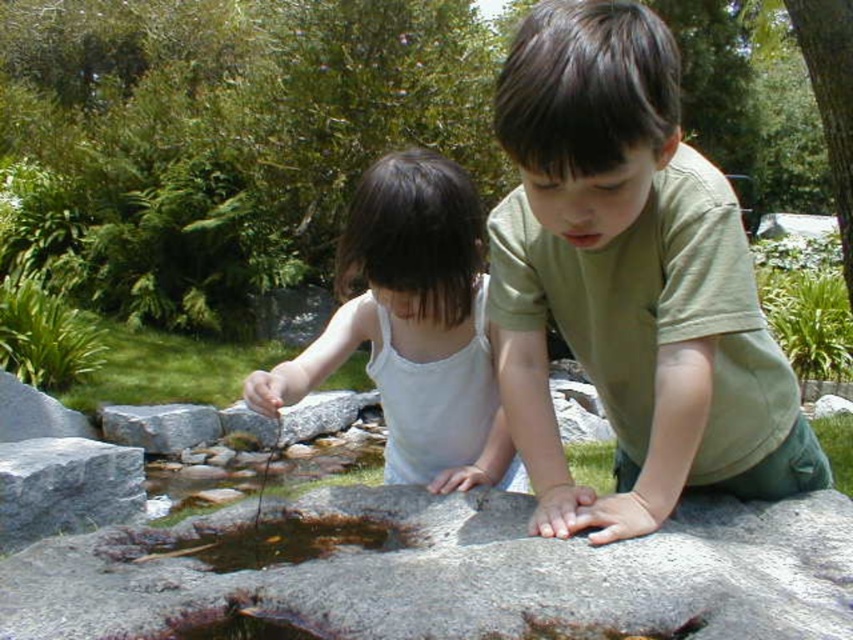
Is point (695, 484) positioned after point (44, 452)?

No, (695, 484) is closer to viewer.

Is point (599, 189) in front of point (71, 442)?

Yes, point (599, 189) is in front of point (71, 442).

Who is more distant from viewer, (589, 342) or (9, 512)?

Point (9, 512)

Identify the location of green cotton shirt at center. This screenshot has width=853, height=640. (630, 280).

Who is higher up, gray smooth rock at center or gray rough stone at lower left?

Positioned higher is gray smooth rock at center.

Who is more forward, (x=309, y=497) or (x=22, y=490)?

Point (x=309, y=497) is more forward.

This screenshot has height=640, width=853. Find the location of `gray smooth rock at center`. gray smooth rock at center is located at coordinates (457, 573).

Does point (368, 205) come farther from viewer compared to point (90, 468)?

That is False.

Is white fabric shirt at center below gray rough stone at lower left?

No.

The width and height of the screenshot is (853, 640). Describe the element at coordinates (413, 326) in the screenshot. I see `white fabric shirt at center` at that location.

Find the location of `white fabric shirt at center`. white fabric shirt at center is located at coordinates (413, 326).